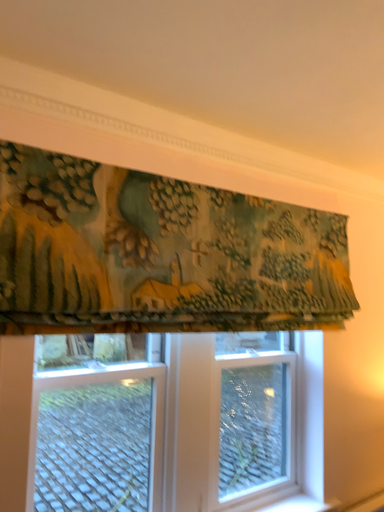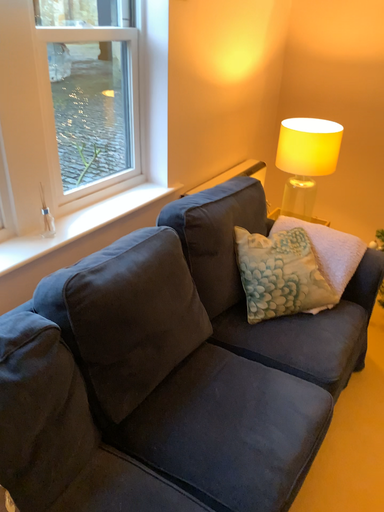
Question: How did the camera likely rotate when shooting the video?

Choices:
 (A) rotated upward
 (B) rotated downward

Answer: (B)